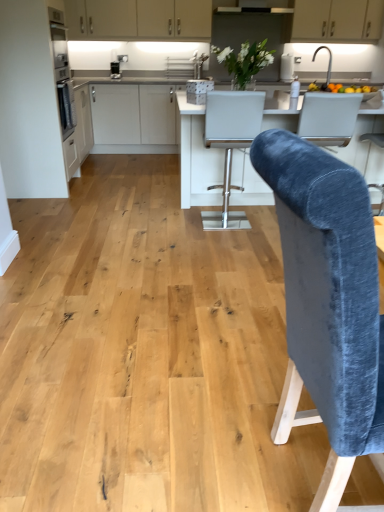
Question: Based on their positions, is velvet blue chair at center, marked as the first chair in a bottom-to-top arrangement, located to the left or right of white leather bar stool at center, which is the second chair from front to back?

Choices:
 (A) left
 (B) right

Answer: (B)

Question: From their relative heights in the image, would you say velvet blue chair at center, which is counted as the first chair, starting from the front, is taller or shorter than white leather bar stool at center, the first chair positioned from the back?

Choices:
 (A) tall
 (B) short

Answer: (A)

Question: Based on their relative distances, which object is farther from the velvet blue chair at center, which is counted as the first chair, starting from the front?

Choices:
 (A) matte white cabinets at upper center, the 2th cabinetry positioned from the back
 (B) satin black coffee machine at upper left
 (C) white leather bar stool at center, the 2th chair when ordered from bottom to top
 (D) white matte cabinetry at left, the first cabinetry when ordered from front to back
 (E) white matte cabinet at upper center, marked as the 1th cabinetry in a top-to-bottom arrangement

Answer: (A)

Question: Which of these objects is positioned closest to the white matte cabinetry at left, which appears as the third cabinetry when viewed from the back?

Choices:
 (A) white leather bar stool at center, the first chair positioned from the back
 (B) velvet blue chair at center, which appears as the 2th chair when viewed from the back
 (C) velvet blue armchair at right
 (D) white glossy countertop at center
 (E) satin black coffee machine at upper left

Answer: (D)